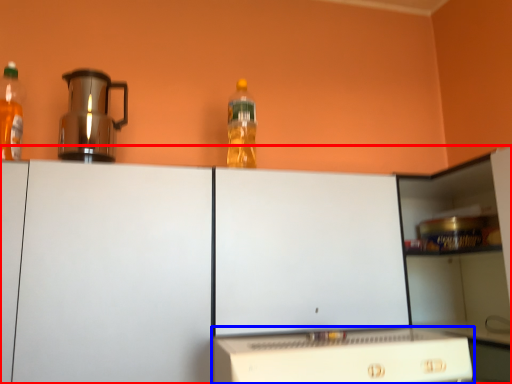
Question: Among these objects, which one is nearest to the camera, cabinetry (highlighted by a red box) or home appliance (highlighted by a blue box)?

Choices:
 (A) cabinetry
 (B) home appliance

Answer: (B)